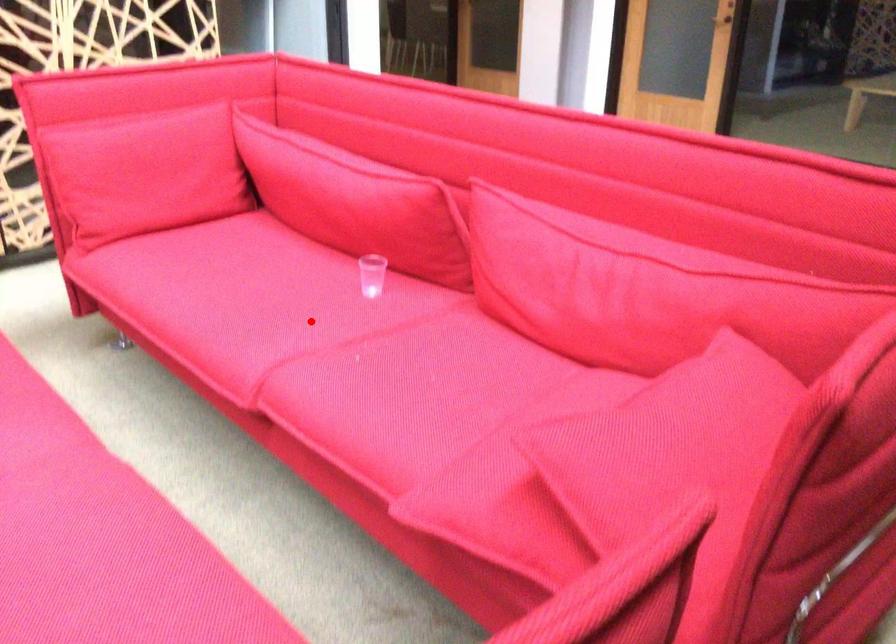
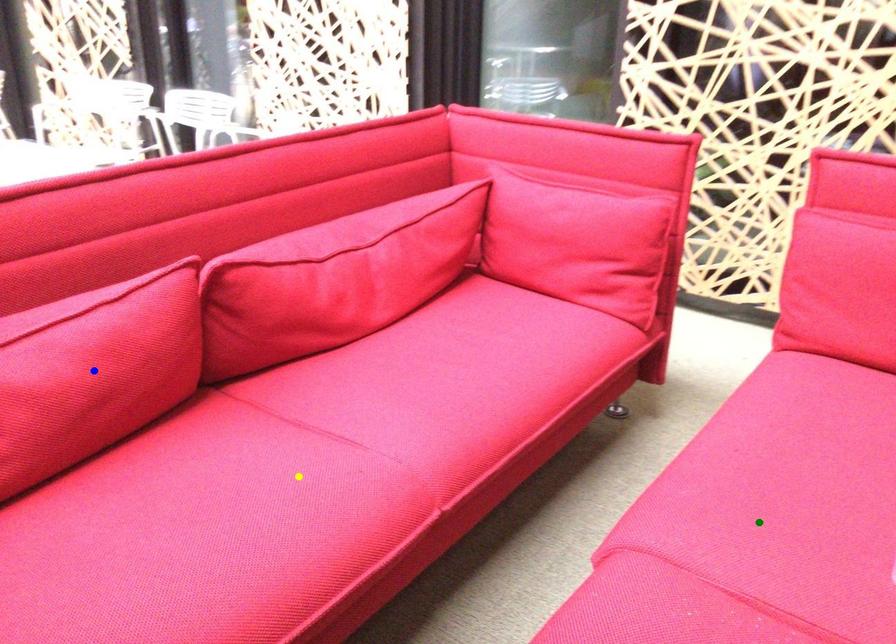
Question: I am providing you with two images of the same scene from different viewpoints. A red point is marked on the first image. You are given multiple points on the second image. Can you choose the point in image 2 that corresponds to the point in image 1?

Choices:
 (A) yellow point
 (B) blue point
 (C) green point

Answer: (C)